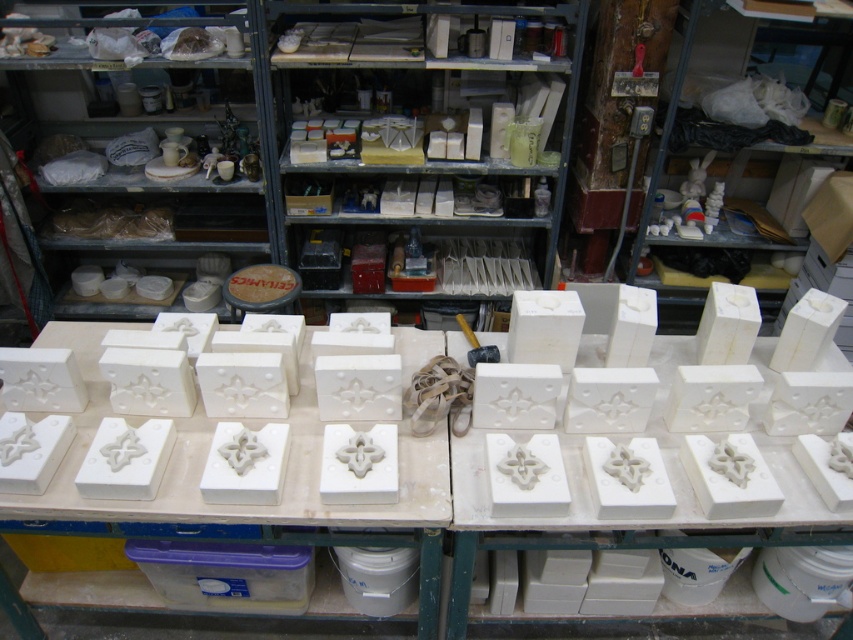
You are an apprentice in the workshop and need to stack the white matte blocks at center and the white matte blocks at upper right. Which block should be placed at the bottom to ensure stability?

The white matte blocks at upper right should be placed at the bottom because they are taller than the white matte blocks at center, providing a more stable base.

You are an artist who needs to choose between the white matte blocks at upper right and the white matte shelves at upper left for your next project. Which object is bigger?

The white matte blocks at upper right is larger in size than the white matte shelves at upper left.

Consider the image. You are an apprentice in the studio and need to place a new tool on the table. The table is a rectangle with its top left corner at point A and bottom right corner at point B. Where on the table should you place the tool so it doesn not interfere with the white matte blocks at center?

The white matte blocks at center are located at point (76, 432), so placing the tool away from that coordinate will ensure it doesn not interfere.